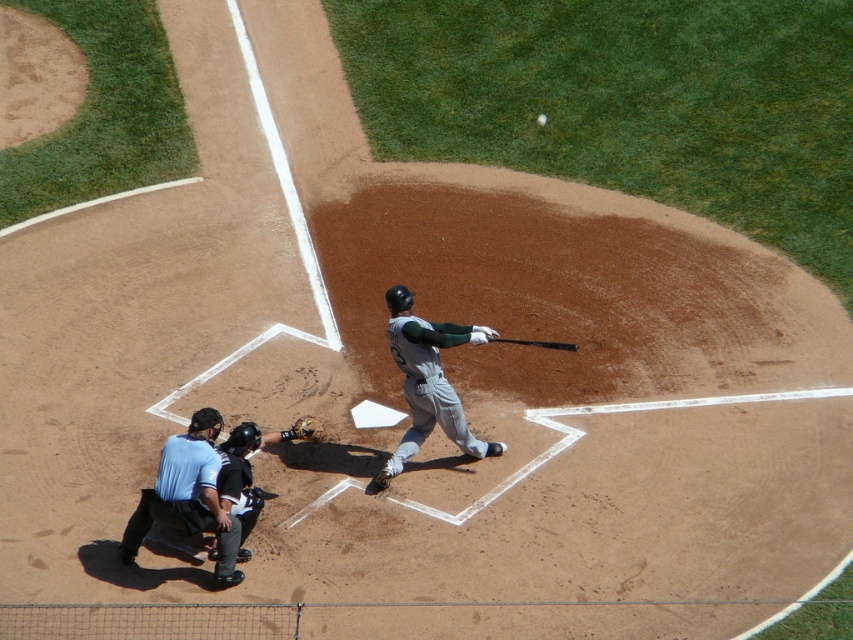
You are a spectator at the baseball game and want to take a photo of the blue shirt at lower left and the black leather glove at lower center. Which object should you focus on first to ensure both are in the frame?

The blue shirt at lower left is positioned under the black leather glove at lower center, so you should focus on the black leather glove at lower center first to ensure both are in the frame.

Based on the photo, you are a baseball player standing at home plate and you see two points marked on the field. The first point is at coordinate point[175,458] and the second is at point[229,500]. Which point is closer to you?

Point[175,458] is in front of point[229,500], so it is closer to you.